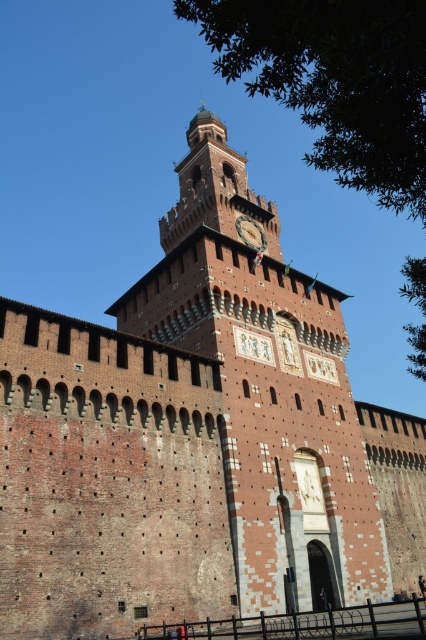
Question: Is green leafy tree at upper right positioned at the back of gold metallic clock at center?

Choices:
 (A) yes
 (B) no

Answer: (B)

Question: Does green leafy tree at upper right appear over gold metallic clock at center?

Choices:
 (A) no
 (B) yes

Answer: (B)

Question: Considering the relative positions of green leafy tree at upper right and gold metallic clock at center in the image provided, where is green leafy tree at upper right located with respect to gold metallic clock at center?

Choices:
 (A) below
 (B) above

Answer: (B)